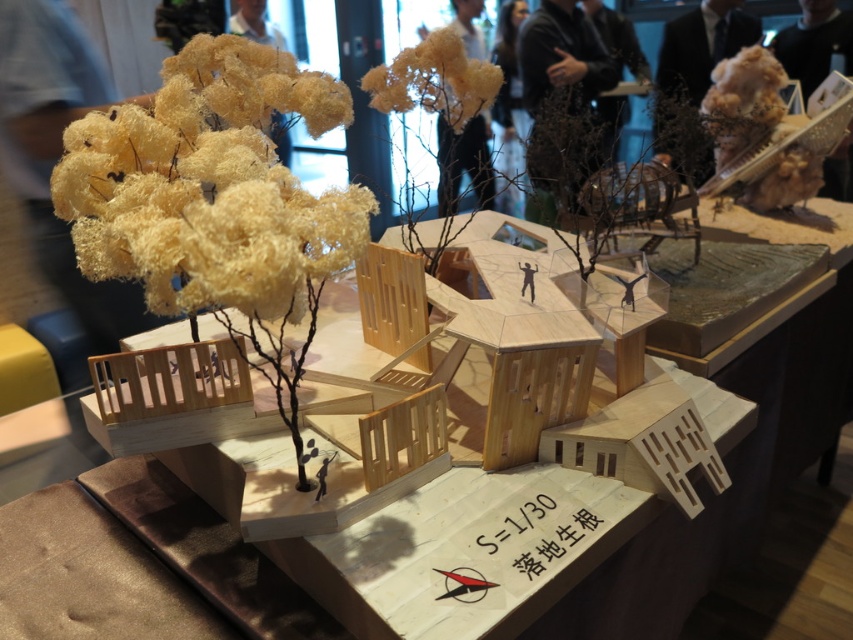
You are an architect reviewing the model. You notice the natural wood model house at center and the fuzzy yellow flower at upper left. Which object is located higher in the image?

The fuzzy yellow flower at upper left is positioned higher than the natural wood model house at center, so the fuzzy yellow flower at upper left is located higher in the image.